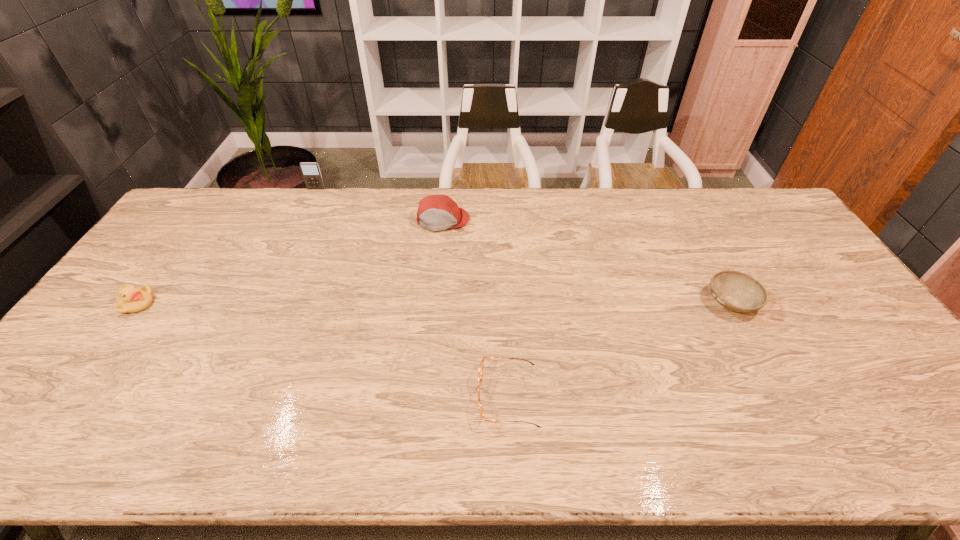
This screenshot has height=540, width=960. I want to click on the fourth object from right to left, so click(311, 173).

This screenshot has width=960, height=540. I want to click on iPod, so click(311, 173).

The width and height of the screenshot is (960, 540). I want to click on cap, so click(x=436, y=212).

Where is `the third object from right to left`? This screenshot has height=540, width=960. the third object from right to left is located at coordinates (436, 212).

Locate an element on the screen. Image resolution: width=960 pixels, height=540 pixels. duckling is located at coordinates point(129,299).

I want to click on bowl, so click(x=736, y=291).

Image resolution: width=960 pixels, height=540 pixels. Identify the location of the second object from right to left. (480, 372).

Find the location of `spectacles`. spectacles is located at coordinates (480, 372).

Identify the location of free space located 0.380m on the front-facing side of the iPod. (284, 258).

I want to click on blank area located on the front-facing side of the third object from left to right, so click(x=440, y=249).